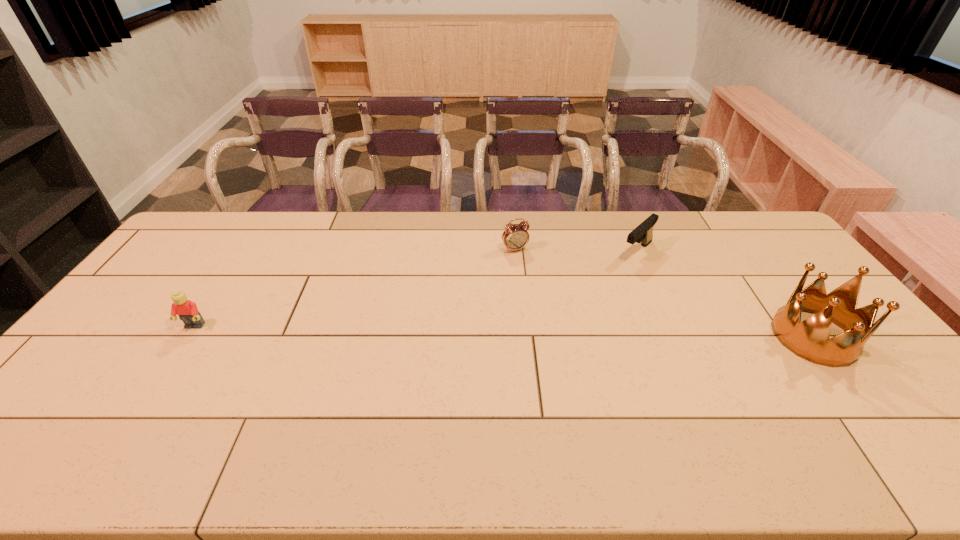
This screenshot has height=540, width=960. I want to click on vacant space that is in between the alarm clock and the second object from right to left, so click(576, 251).

What are the coordinates of `vacant space in between the leftmost object and the tallest object` in the screenshot? It's located at (504, 332).

Where is `object that is the second closest to the third object from right to left`? The width and height of the screenshot is (960, 540). object that is the second closest to the third object from right to left is located at coordinates (810, 339).

The width and height of the screenshot is (960, 540). Find the location of `object that is the third nearest to the pistol`. object that is the third nearest to the pistol is located at coordinates (187, 311).

This screenshot has width=960, height=540. I want to click on free location that satisfies the following two spatial constraints: 1. on the face of the Lego; 2. on the left side of the rightmost object, so click(188, 336).

I want to click on vacant area in the image that satisfies the following two spatial constraints: 1. on the front side of the pistol; 2. on the left side of the alarm clock, so click(x=516, y=252).

This screenshot has height=540, width=960. Identify the location of free space that satisfies the following two spatial constraints: 1. on the front side of the rightmost object; 2. on the left side of the alarm clock. (523, 336).

Where is `vacant area in the image that satisfies the following two spatial constraints: 1. on the face of the Lego; 2. on the right side of the tallest object`? This screenshot has height=540, width=960. vacant area in the image that satisfies the following two spatial constraints: 1. on the face of the Lego; 2. on the right side of the tallest object is located at coordinates (188, 336).

You are a GUI agent. You are given a task and a screenshot of the screen. Output one action in this format:
    pyautogui.click(x=<x>, y=<y>)
    Task: Click on the vacant region that satisfies the following two spatial constraints: 1. on the face of the Lego; 2. on the left side of the crown
    The width and height of the screenshot is (960, 540).
    Given the screenshot: What is the action you would take?
    pyautogui.click(x=188, y=336)

In order to click on vacant space that satisfies the following two spatial constraints: 1. on the face of the tallest object; 2. on the right side of the leftmost object in this screenshot , I will do `click(188, 336)`.